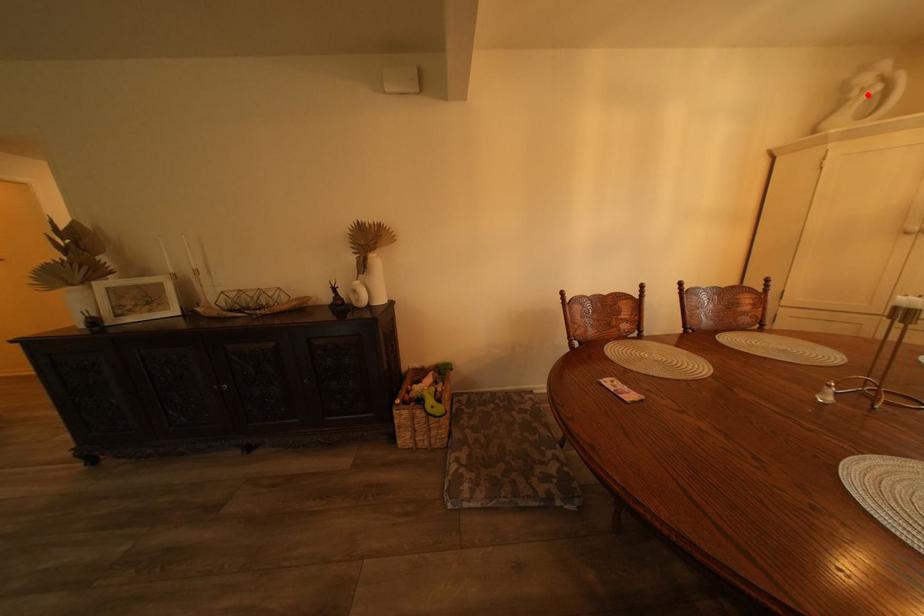
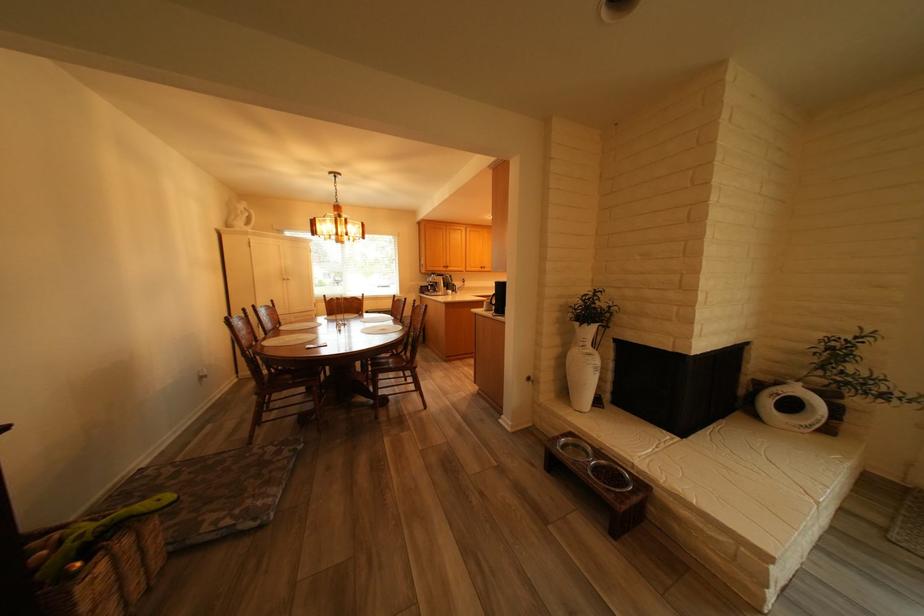
Find the pixel in the second image that matches the highlighted location in the first image.

(253, 213)